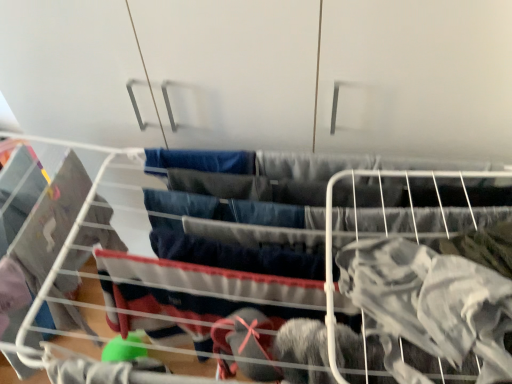
What do you see at coordinates (429, 304) in the screenshot?
I see `white cotton shirt at right` at bounding box center [429, 304].

The height and width of the screenshot is (384, 512). Find the location of `white cotton shirt at right`. white cotton shirt at right is located at coordinates (429, 304).

Image resolution: width=512 pixels, height=384 pixels. Identify the location of white cotton shirt at right. (429, 304).